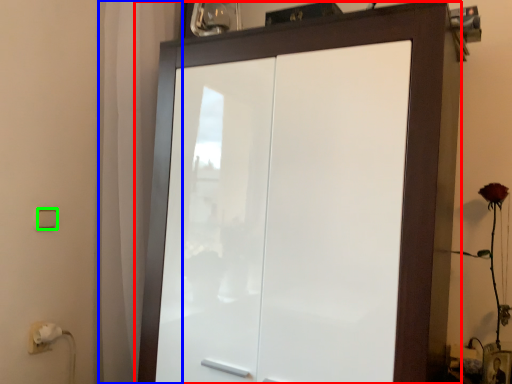
Question: Estimate the real-world distances between objects in this image. Which object is closer to cupboard (highlighted by a red box), curtain (highlighted by a blue box) or light switch (highlighted by a green box)?

Choices:
 (A) curtain
 (B) light switch

Answer: (A)